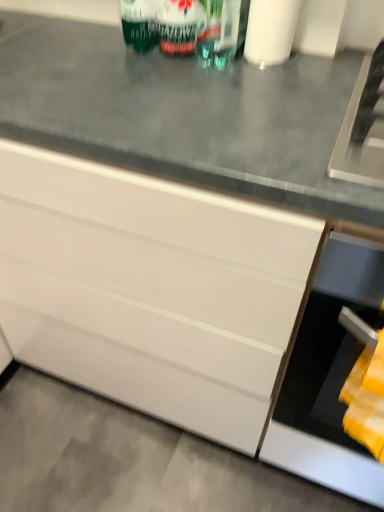
This screenshot has width=384, height=512. Find the location of `vacant region to the right of green glass wine bottle at upper center`. vacant region to the right of green glass wine bottle at upper center is located at coordinates click(309, 76).